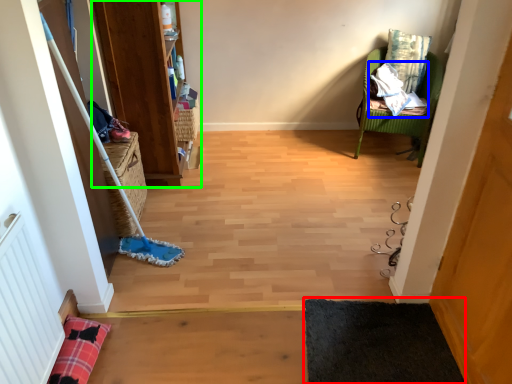
Question: Which object is the farthest from yoga mat (highlighted by a red box)? Choose among these: material (highlighted by a blue box) or bookshelf (highlighted by a green box).

Choices:
 (A) material
 (B) bookshelf

Answer: (A)